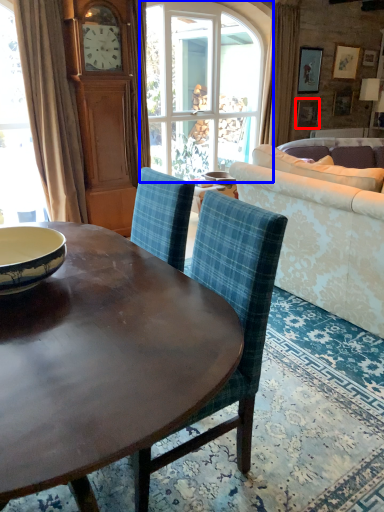
Question: Which object appears farthest to the camera in this image, picture frame (highlighted by a red box) or window (highlighted by a blue box)?

Choices:
 (A) picture frame
 (B) window

Answer: (A)